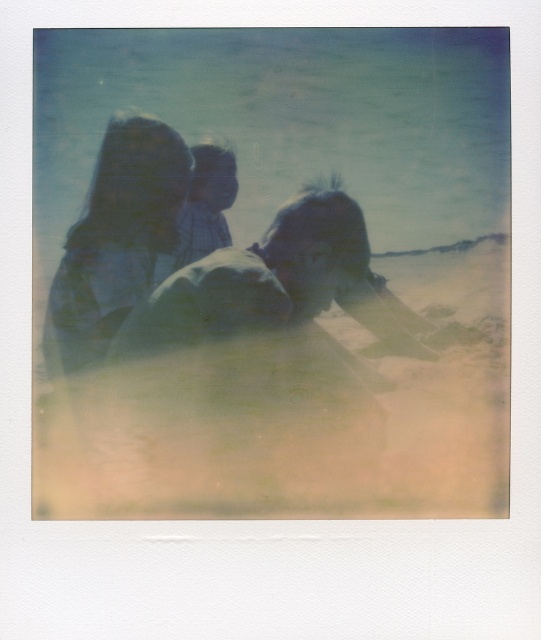
You are a photographer trying to place a new element in the Polaroid photo. The blue fabric couple at center is located at coordinates 0.398, 0.377. Where should you position the new element so it doesn not overlap with them?

The blue fabric couple at center is located at coordinates (203, 253). To avoid overlapping, position the new element away from these coordinates, such as near the edges or corners of the image.

You are a photographer trying to arrange two subjects in a vintage Polaroid photo. You have a blue fabric couple at center and a plaid fabric shirt at center. Based on the scene, which subject should be placed to the right side?

Answer: The blue fabric couple at center should be placed to the right side of the plaid fabric shirt at center as per the description.